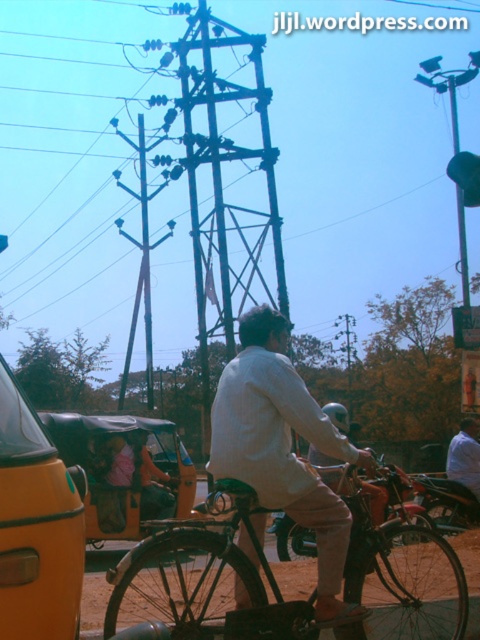
You are a pedestrian standing on the sidewalk and want to cross the street. There is a yellow matte taxi at left and a shiny chrome motorcycle at center. Which vehicle is closer to you?

The yellow matte taxi at left is above the shiny chrome motorcycle at center, so the motorcycle is closer to you since it is positioned lower in the image, which typically indicates it is nearer to the observer.

You are a pedestrian standing on the sidewalk observing the scene. You notice the light beige fabric shirt at center and the shiny chrome motorcycle at center. Which object is positioned higher in the image?

The light beige fabric shirt at center is above the shiny chrome motorcycle at center, so the light beige fabric shirt at center is positioned higher in the image.

You are a delivery person who needs to load a package onto the shiny black bicycle at center. The package requires a rack that must be at least as tall as the metallic structure at center. Can the package be placed on the bicycle without the rack?

The shiny black bicycle at center is shorter than the metallic structure at center, so the package cannot be placed on the bicycle without the rack because the rack needs to be at least as tall as the metallic structure.